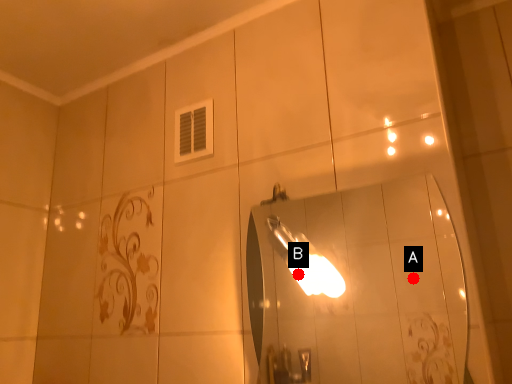
Question: Two points are circled on the image, labeled by A and B beside each circle. Among these points, which one is nearest to the camera?

Choices:
 (A) A is closer
 (B) B is closer

Answer: (B)